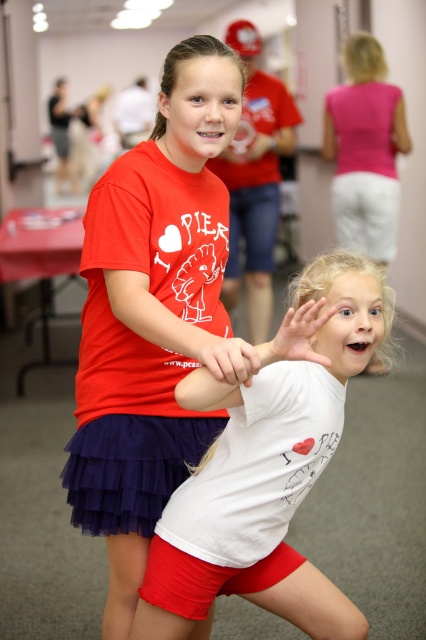
Does point (192, 376) lie behind point (152, 444)?

No, (192, 376) is in front of (152, 444).

Is point (264, 593) in front of point (158, 464)?

No, (264, 593) is further to viewer.

Between point (299, 604) and point (224, 236), which one is positioned behind?

Positioned behind is point (224, 236).

At what (x,y) coordinates should I click in order to perform the action: click on white matte t-shirt at center. Please return your answer as a coordinate pair (x, y). Looking at the image, I should click on (267, 468).